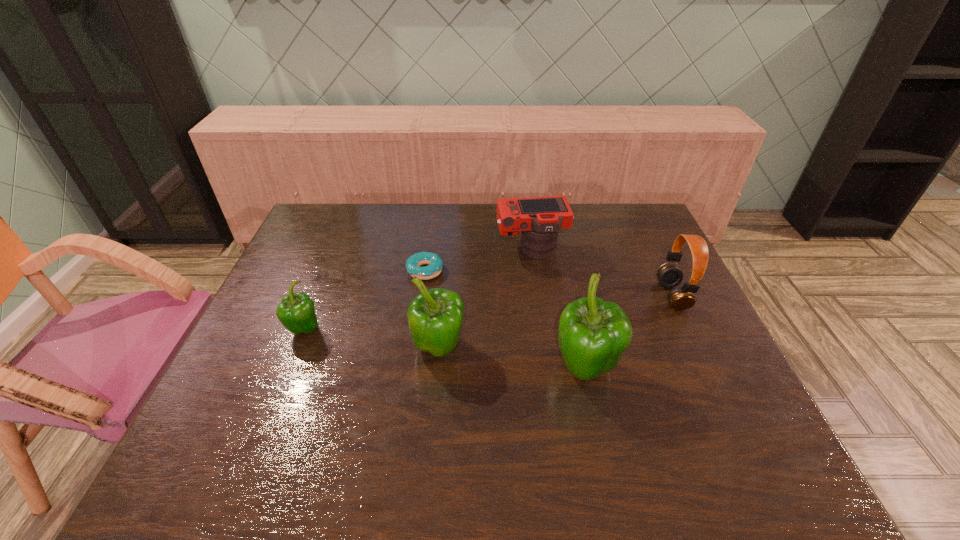
Locate an element on the screen. the shortest bell pepper is located at coordinates (296, 312).

I want to click on the leftmost bell pepper, so click(296, 312).

In order to click on the second bell pepper from right to left in this screenshot , I will do `click(435, 317)`.

The height and width of the screenshot is (540, 960). I want to click on the rightmost bell pepper, so click(x=593, y=334).

The width and height of the screenshot is (960, 540). In order to click on camera in this screenshot , I will do `click(539, 219)`.

In order to click on the shortest object in this screenshot , I will do `click(413, 263)`.

The width and height of the screenshot is (960, 540). Find the location of `the rightmost object`. the rightmost object is located at coordinates (669, 275).

Where is `free space located 0.180m on the back of the leftmost object`? The height and width of the screenshot is (540, 960). free space located 0.180m on the back of the leftmost object is located at coordinates (326, 275).

Image resolution: width=960 pixels, height=540 pixels. Find the location of `blank space located on the back of the second tallest bell pepper`. blank space located on the back of the second tallest bell pepper is located at coordinates (445, 273).

At what (x,y) coordinates should I click in order to perform the action: click on vacant area situated 0.320m on the back of the rightmost bell pepper. Please return your answer as a coordinate pair (x, y). The image size is (960, 540). Looking at the image, I should click on (562, 265).